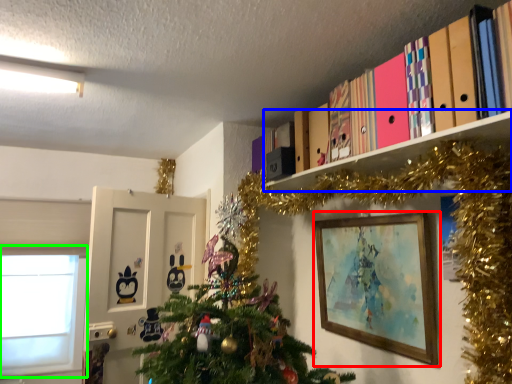
Question: Which object is positioned closest to picture frame (highlighted by a red box)? Select from shelf (highlighted by a blue box) and window (highlighted by a green box).

Choices:
 (A) shelf
 (B) window

Answer: (A)